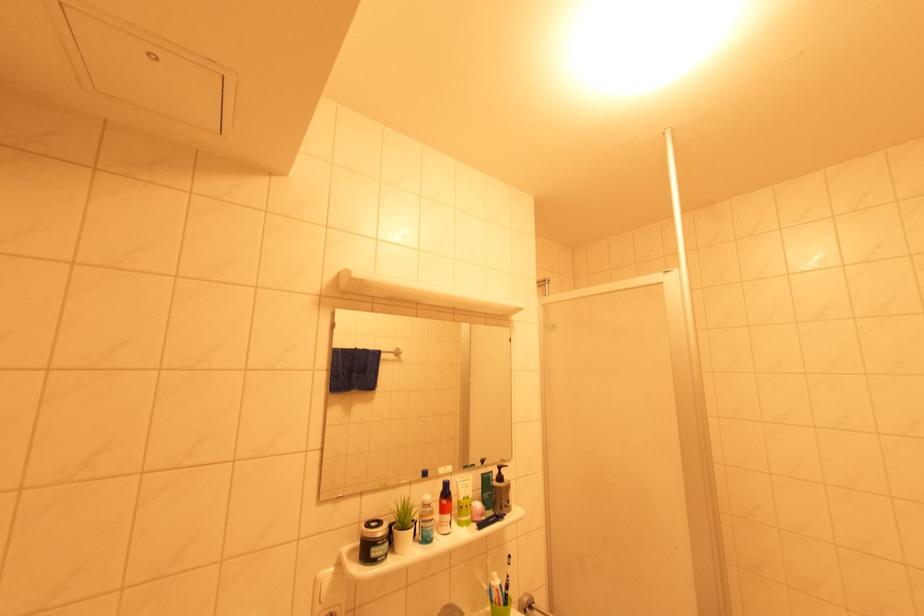
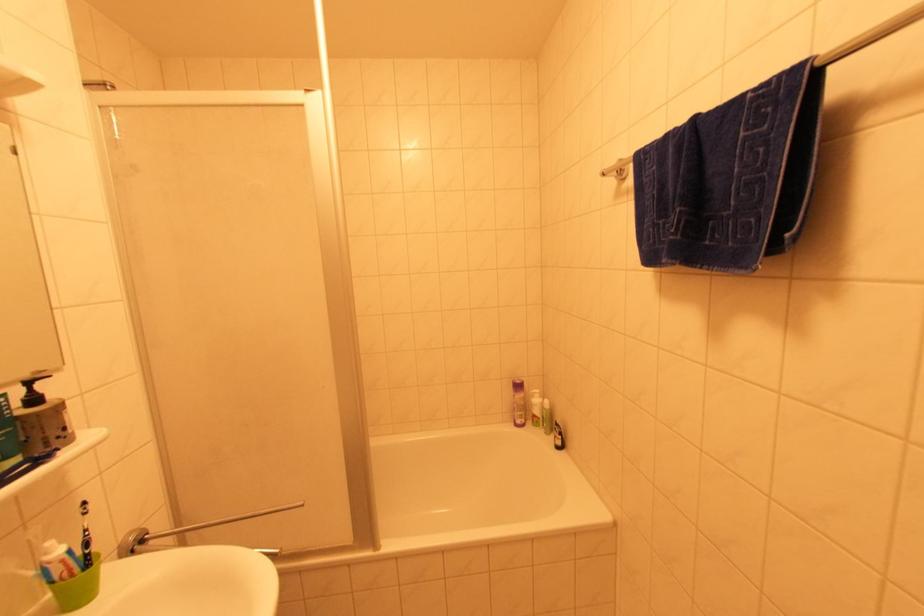
Question: The first image is from the beginning of the video and the second image is from the end. How did the camera likely rotate when shooting the video?

Choices:
 (A) Left
 (B) Right
 (C) Up
 (D) Down

Answer: (B)